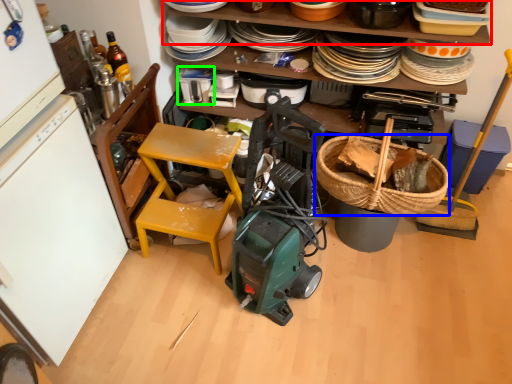
Question: Which object is positioned farthest from shelf (highlighted by a red box)? Select from picnic basket (highlighted by a blue box) and appliance (highlighted by a green box).

Choices:
 (A) picnic basket
 (B) appliance

Answer: (A)